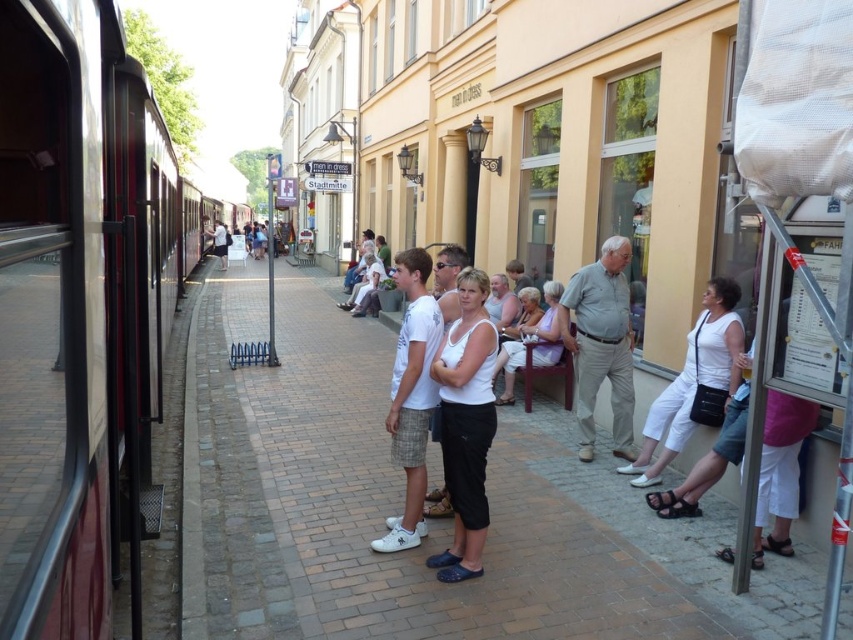
You are a passenger carrying a large suitcase and need to walk from the brick pavement at center to the train doors. How much distance do you need to cover?

The distance between the brick pavement at center and the train doors is 3.27 meters, so you need to cover 3.27 meters to reach the train doors.

You are standing on the platform at the train station. There is a point marked at coordinates (430, 520). What is located at that point?

The point at coordinates (430, 520) marks brick pavement at center.